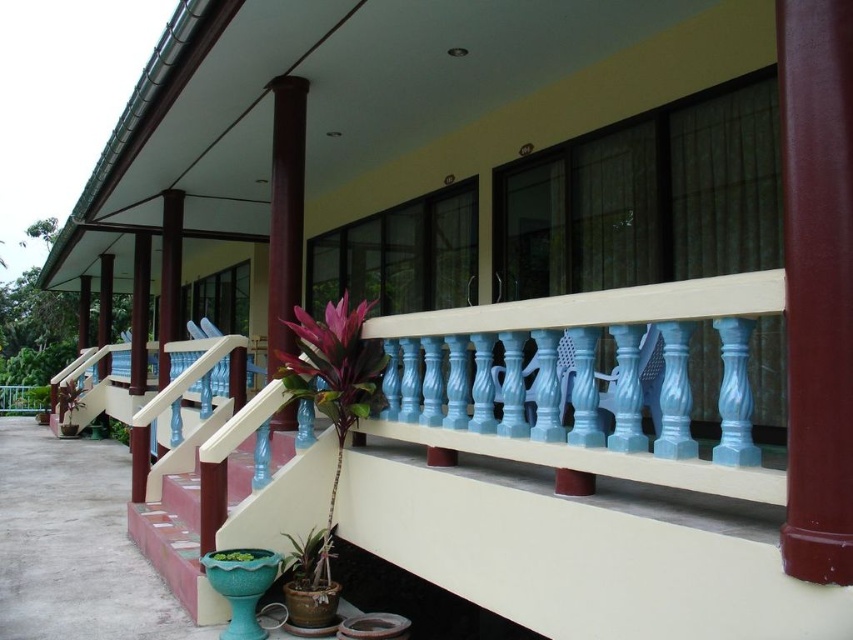
Which is more to the right, smooth terracotta stairs at center or green matte plant at lower center?

From the viewer's perspective, green matte plant at lower center appears more on the right side.

Is smooth terracotta stairs at center further to camera compared to green matte plant at lower center?

Yes, smooth terracotta stairs at center is behind green matte plant at lower center.

The image size is (853, 640). Identify the location of smooth terracotta stairs at center. (277, 492).

Can you confirm if green glossy plant at lower left is wider than green leafy plant at lower left?

Incorrect, green glossy plant at lower left's width does not surpass green leafy plant at lower left's.

Is point (65, 406) positioned after point (120, 422)?

Yes, point (65, 406) is behind point (120, 422).

Locate an element on the screen. The width and height of the screenshot is (853, 640). green glossy plant at lower left is located at coordinates (68, 401).

Who is positioned more to the left, shiny green leaf at center or brown polished wood column at center?

Positioned to the left is brown polished wood column at center.

Between shiny green leaf at center and brown polished wood column at center, which one is positioned lower?

shiny green leaf at center is below.

Does point (352, 404) come behind point (292, 202)?

That is False.

Where is `shiny green leaf at center`? Image resolution: width=853 pixels, height=640 pixels. shiny green leaf at center is located at coordinates (334, 385).